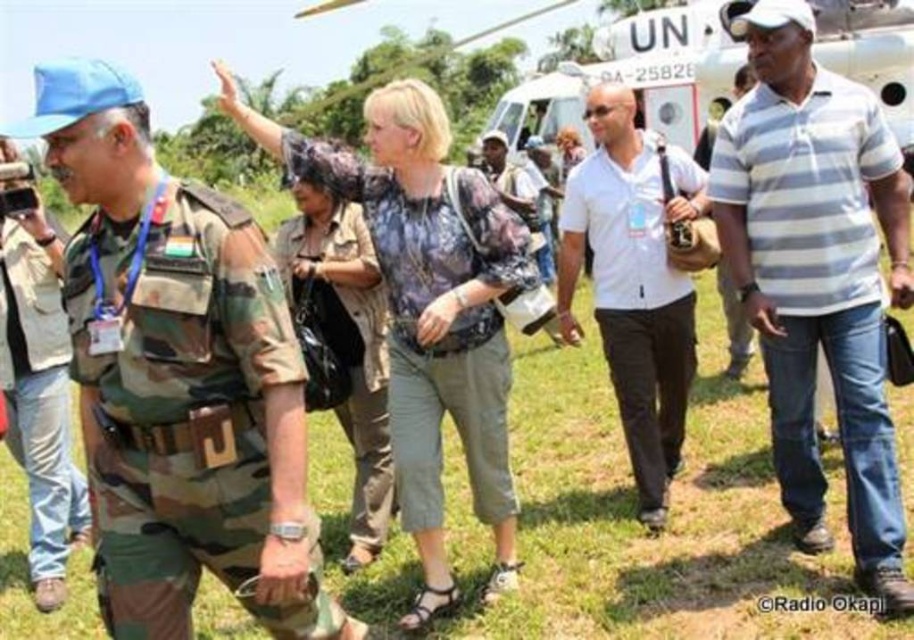
You are standing at the point labeled as point (607, 104) and want to move to the point labeled as point (236, 548). Which direction should you walk to get closer to your destination?

You should walk towards the lower right direction because point (236, 548) is closer to the viewer than point (607, 104), indicating it is located in a lower and rightward position in the image.